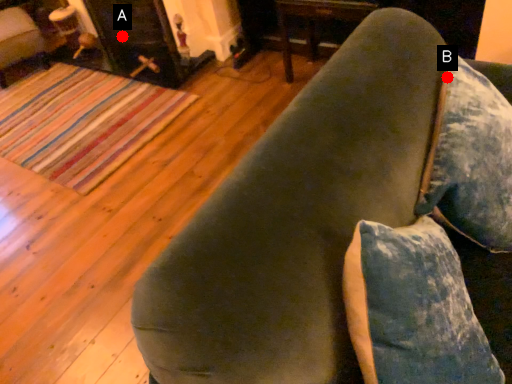
Question: Two points are circled on the image, labeled by A and B beside each circle. Among these points, which one is farthest from the camera?

Choices:
 (A) A is further
 (B) B is further

Answer: (A)